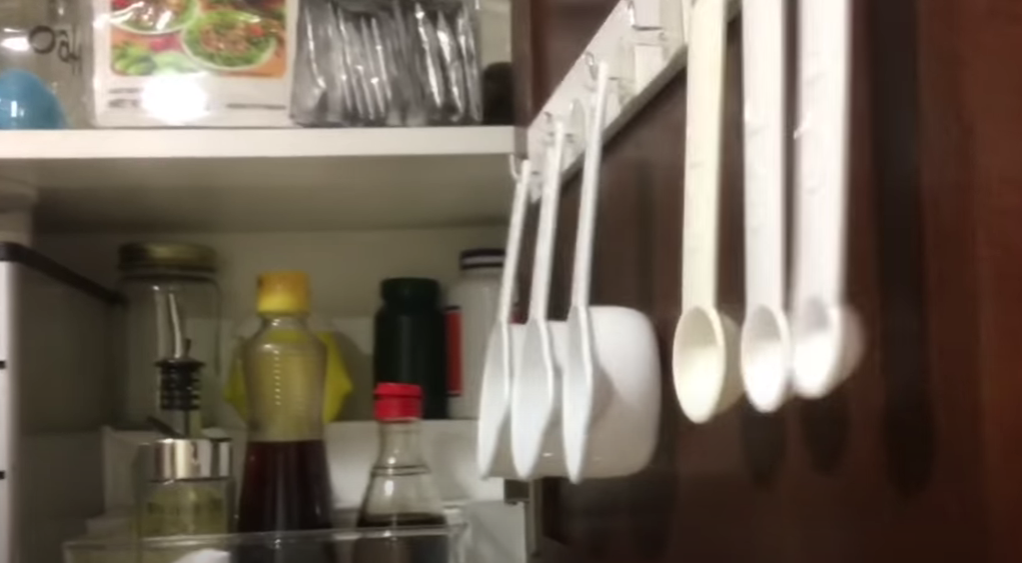
Where is `silver hooks`? The width and height of the screenshot is (1022, 563). silver hooks is located at coordinates (551, 119), (641, 19), (533, 168).